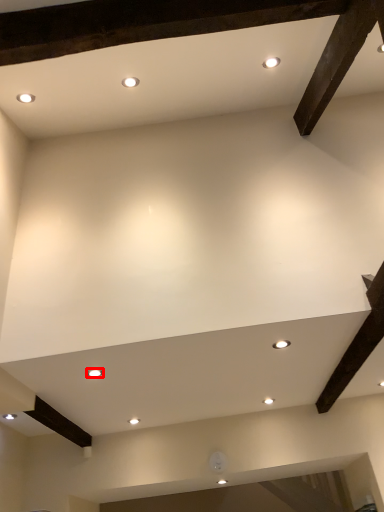
Question: From the image's perspective, what is the correct spatial relationship of lighting (annotated by the red box) in relation to lighting?

Choices:
 (A) above
 (B) below

Answer: (B)